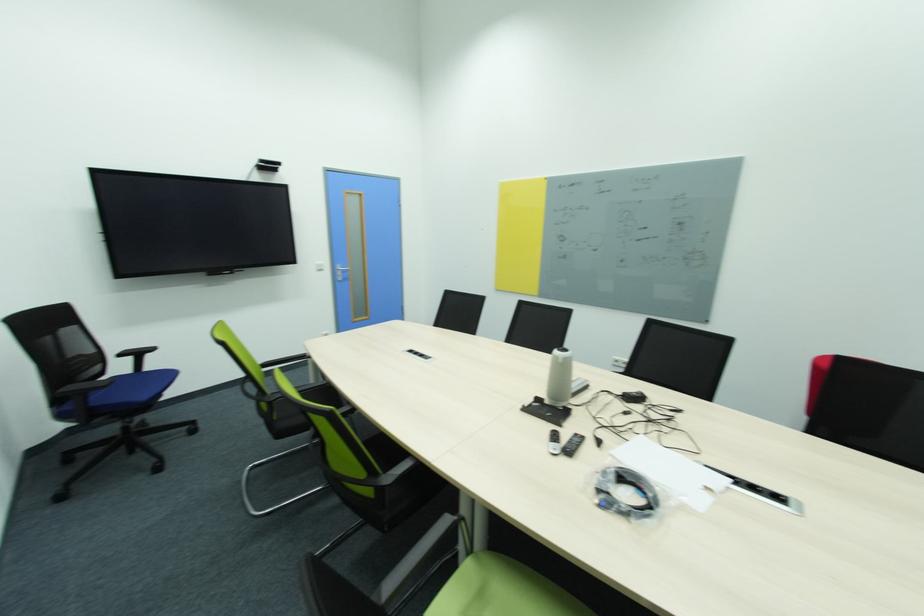
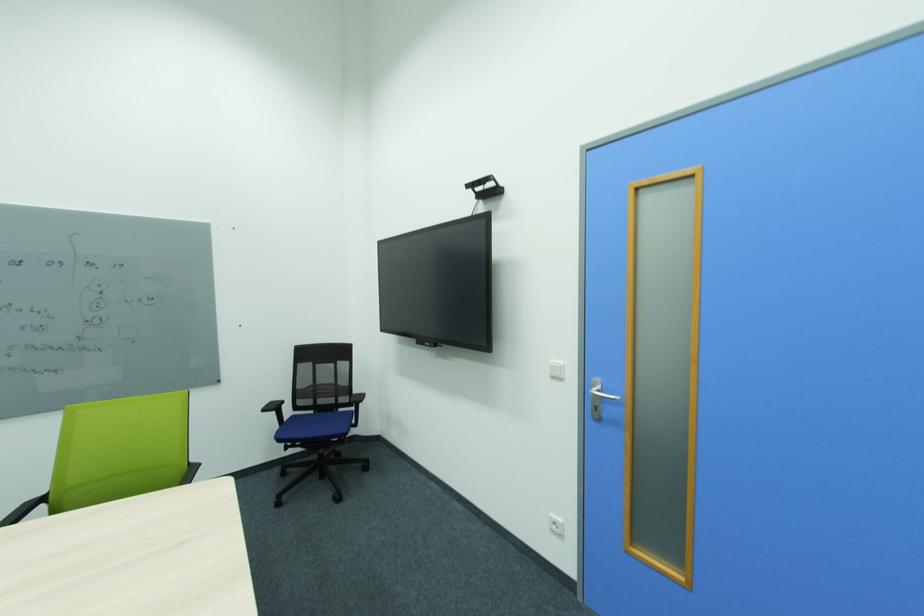
Find the pixel in the second image that matches pixel 322 267 in the first image.

(557, 368)